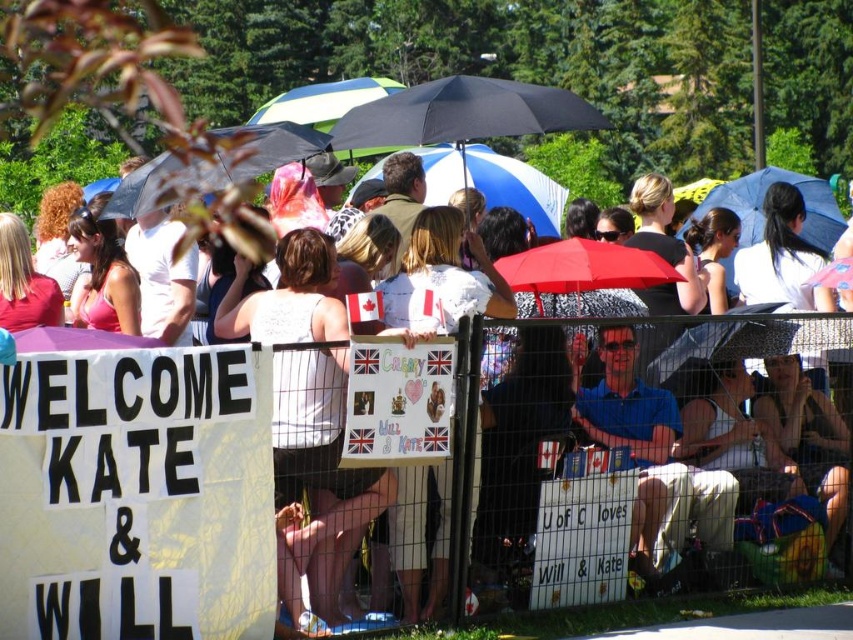
Who is lower down, white paper sign at center or black matte umbrella at center?

Positioned lower is white paper sign at center.

Can you confirm if white paper sign at center is positioned below black matte umbrella at center?

Correct, white paper sign at center is located below black matte umbrella at center.

Is point (564, 600) farther from viewer compared to point (254, 163)?

That is False.

You are a GUI agent. You are given a task and a screenshot of the screen. Output one action in this format:
    pyautogui.click(x=<x>, y=<y>)
    Task: Click on the white paper sign at center
    The height and width of the screenshot is (640, 853).
    Given the screenshot: What is the action you would take?
    pyautogui.click(x=582, y=540)

Which of these two, metal mesh fence at center or blue fabric umbrella at upper right, stands taller?

metal mesh fence at center

Which is in front, point (709, 349) or point (817, 246)?

Positioned in front is point (709, 349).

You are a GUI agent. You are given a task and a screenshot of the screen. Output one action in this format:
    pyautogui.click(x=<x>, y=<y>)
    Task: Click on the metal mesh fence at center
    
    Given the screenshot: What is the action you would take?
    pyautogui.click(x=592, y=499)

Which is above, black matte umbrella at center or blue and white striped umbrella at center?

black matte umbrella at center is above.

Who is more distant from viewer, (244, 150) or (549, 234)?

The point (549, 234) is more distant.

Does point (286, 140) come behind point (547, 236)?

No, it is not.

You are a GUI agent. You are given a task and a screenshot of the screen. Output one action in this format:
    pyautogui.click(x=<x>, y=<y>)
    Task: Click on the black matte umbrella at center
    Image resolution: width=853 pixels, height=640 pixels.
    Given the screenshot: What is the action you would take?
    pyautogui.click(x=213, y=166)